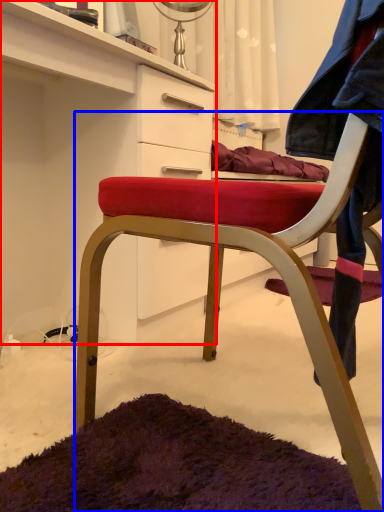
Question: Which object appears farthest to the camera in this image, cabinetry (highlighted by a red box) or chair (highlighted by a blue box)?

Choices:
 (A) cabinetry
 (B) chair

Answer: (A)